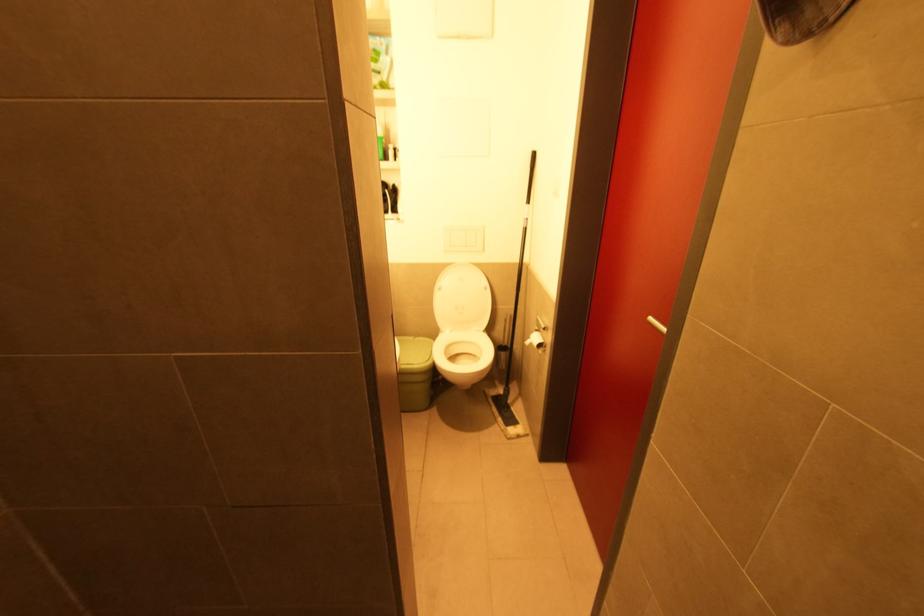
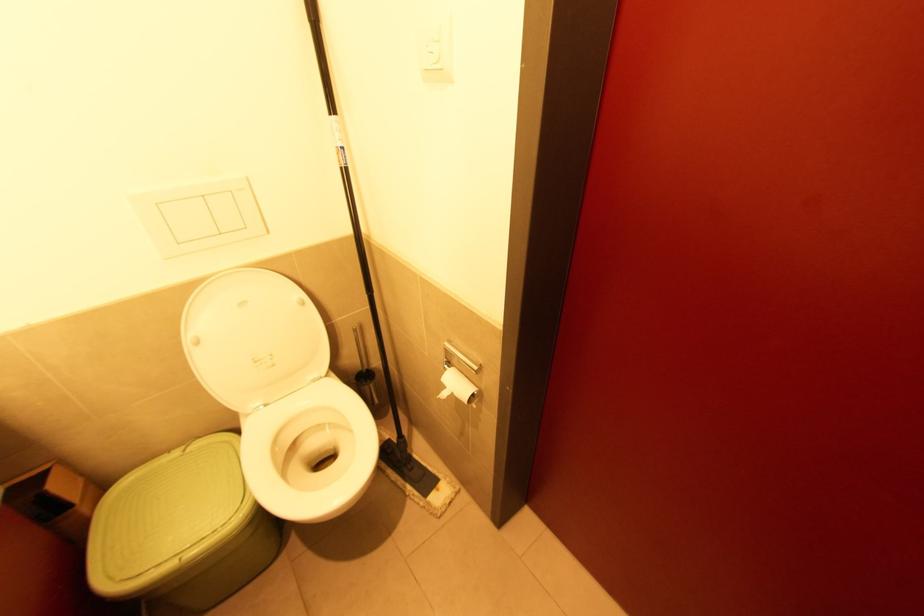
Locate, in the second image, the point that corresponds to (526,230) in the first image.

(347, 172)